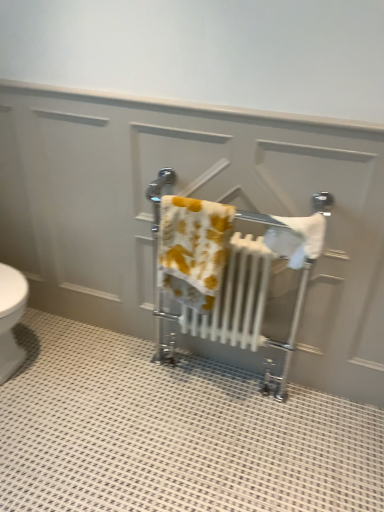
Identify the location of free area below white metallic towel rack at center (from a real-world perspective). The image size is (384, 512). (223, 378).